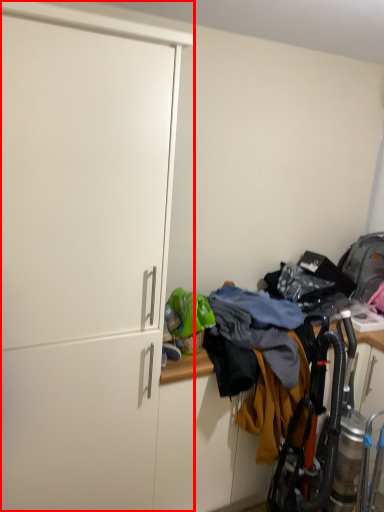
Question: From the image's perspective, what is the correct spatial positioning of cabinetry (annotated by the red box) in reference to laundry?

Choices:
 (A) above
 (B) below

Answer: (A)